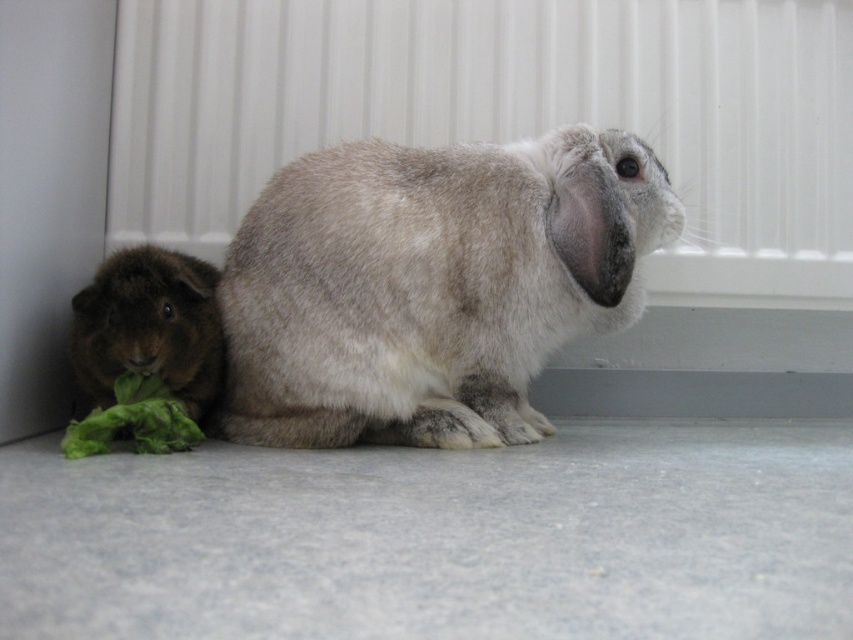
Question: Where is fuzzy gray rabbit at center located in relation to brown fuzzy guinea pig at lower left in the image?

Choices:
 (A) right
 (B) left

Answer: (A)

Question: Is fuzzy gray rabbit at center below brown fuzzy guinea pig at lower left?

Choices:
 (A) yes
 (B) no

Answer: (B)

Question: Which point is farther to the camera?

Choices:
 (A) (102, 292)
 (B) (403, 170)

Answer: (B)

Question: Is fuzzy gray rabbit at center bigger than brown fuzzy guinea pig at lower left?

Choices:
 (A) yes
 (B) no

Answer: (A)

Question: Which of the following is the closest to the observer?

Choices:
 (A) (213, 316)
 (B) (370, 161)

Answer: (A)